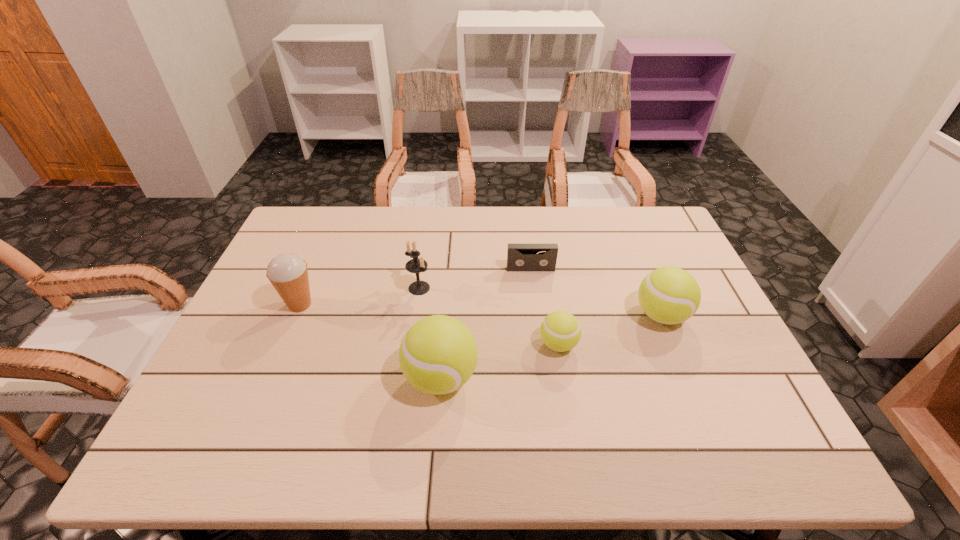
Observe the arrangement of all tennis balls in the image. To keep them evenly spaced, where would you place another tennis ball on the left? Please locate a free space. Please provide its 2D coordinates. Your answer should be formatted as a tuple, i.e. [(x, y)], where the tuple contains the x and y coordinates of a point satisfying the conditions above.

[(305, 416)]